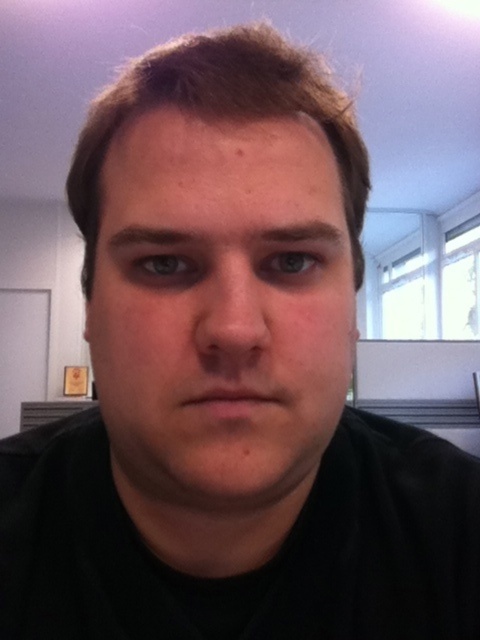
You are a photographer adjusting the lighting for a portrait. You notice the matte skin nose at center and the dark brown hair at center. Which of these two features might require more careful lighting to avoid shadows, based on their size in the frame?

The matte skin nose at center is taller than the dark brown hair at center, so the nose may require more careful lighting to avoid shadows due to its larger size in the frame.

Based on the scene description, can you determine if the smooth skin face at center is positioned closer to the viewer than the dark brown eyebrow at upper center?

The smooth skin face at center is in front of the dark brown eyebrow at upper center, so yes, it is closer to the viewer.

Looking at the person in the image, which object takes up more space in the frame between the smooth skin face at center and the dark brown hair at center?

The smooth skin face at center takes up more space in the frame than the dark brown hair at center.